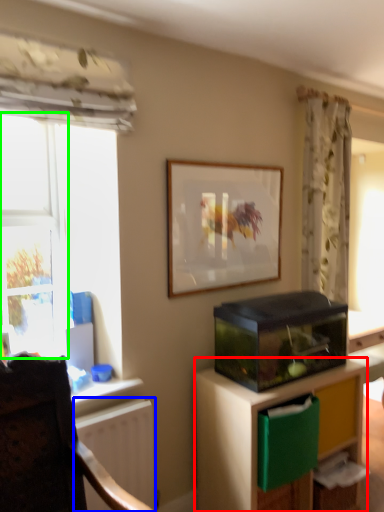
Question: Estimate the real-world distances between objects in this image. Which object is closer to cabinetry (highlighted by a red box), radiator (highlighted by a blue box) or window (highlighted by a green box)?

Choices:
 (A) radiator
 (B) window

Answer: (A)